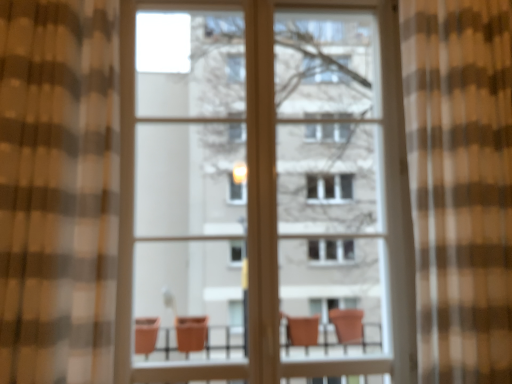
Question: From a real-world perspective, is brown sheer curtain at right, marked as the first curtain in a right-to-left arrangement, on matte glass screen door at center?

Choices:
 (A) yes
 (B) no

Answer: (B)

Question: Considering the relative sizes of brown sheer curtain at right, marked as the first curtain in a right-to-left arrangement, and matte glass screen door at center in the image provided, is brown sheer curtain at right, marked as the first curtain in a right-to-left arrangement, shorter than matte glass screen door at center?

Choices:
 (A) yes
 (B) no

Answer: (A)

Question: From the image's perspective, is brown sheer curtain at right, marked as the first curtain in a right-to-left arrangement, below matte glass screen door at center?

Choices:
 (A) yes
 (B) no

Answer: (B)

Question: Does brown sheer curtain at right, placed as the second curtain when sorted from left to right, have a lesser width compared to matte glass screen door at center?

Choices:
 (A) no
 (B) yes

Answer: (A)

Question: Is brown sheer curtain at right, placed as the second curtain when sorted from left to right, next to matte glass screen door at center and touching it?

Choices:
 (A) no
 (B) yes

Answer: (A)

Question: In terms of height, does brown checkered curtain at left, which ranks as the second curtain in right-to-left order, look taller or shorter compared to matte glass screen door at center?

Choices:
 (A) tall
 (B) short

Answer: (B)

Question: Looking at the image, does brown checkered curtain at left, which is the 1th curtain from left to right, seem bigger or smaller compared to matte glass screen door at center?

Choices:
 (A) small
 (B) big

Answer: (B)

Question: Is brown checkered curtain at left, which ranks as the second curtain in right-to-left order, situated inside matte glass screen door at center or outside?

Choices:
 (A) outside
 (B) inside

Answer: (A)

Question: Is brown checkered curtain at left, which ranks as the second curtain in right-to-left order, wider or thinner than matte glass screen door at center?

Choices:
 (A) thin
 (B) wide

Answer: (B)

Question: Relative to brown checkered curtain at left, which is the 1th curtain from left to right, is matte glass screen door at center in front or behind?

Choices:
 (A) front
 (B) behind

Answer: (B)

Question: Is matte glass screen door at center bigger or smaller than brown checkered curtain at left, which is the 1th curtain from left to right?

Choices:
 (A) big
 (B) small

Answer: (B)

Question: From a real-world perspective, relative to brown checkered curtain at left, which ranks as the second curtain in right-to-left order, is matte glass screen door at center vertically above or below?

Choices:
 (A) below
 (B) above

Answer: (B)

Question: Do you think matte glass screen door at center is within brown checkered curtain at left, which ranks as the second curtain in right-to-left order, or outside of it?

Choices:
 (A) outside
 (B) inside

Answer: (A)

Question: From the image's perspective, relative to matte glass screen door at center, is brown sheer curtain at right, placed as the second curtain when sorted from left to right, above or below?

Choices:
 (A) below
 (B) above

Answer: (B)

Question: Is point (417, 271) closer or farther from the camera than point (227, 276)?

Choices:
 (A) closer
 (B) farther

Answer: (A)